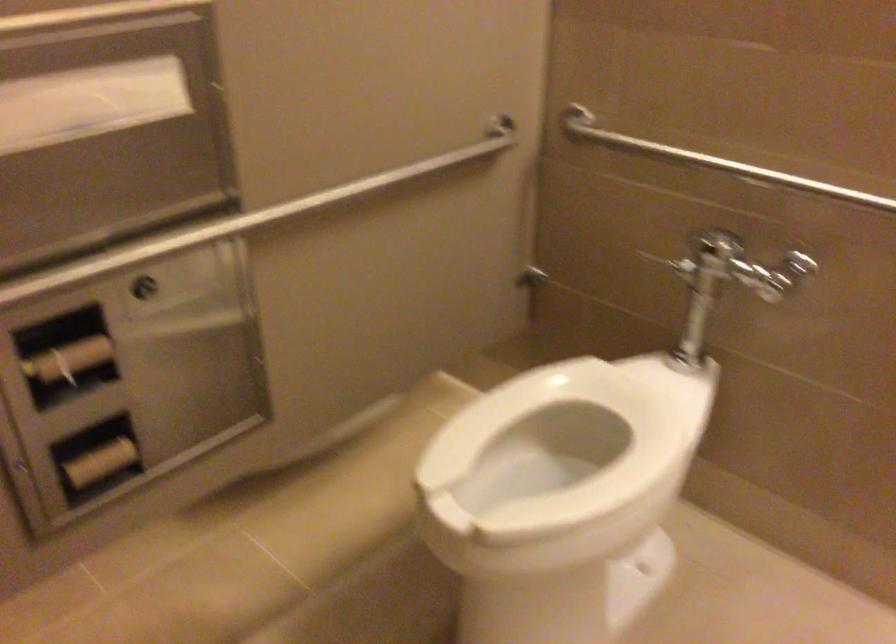
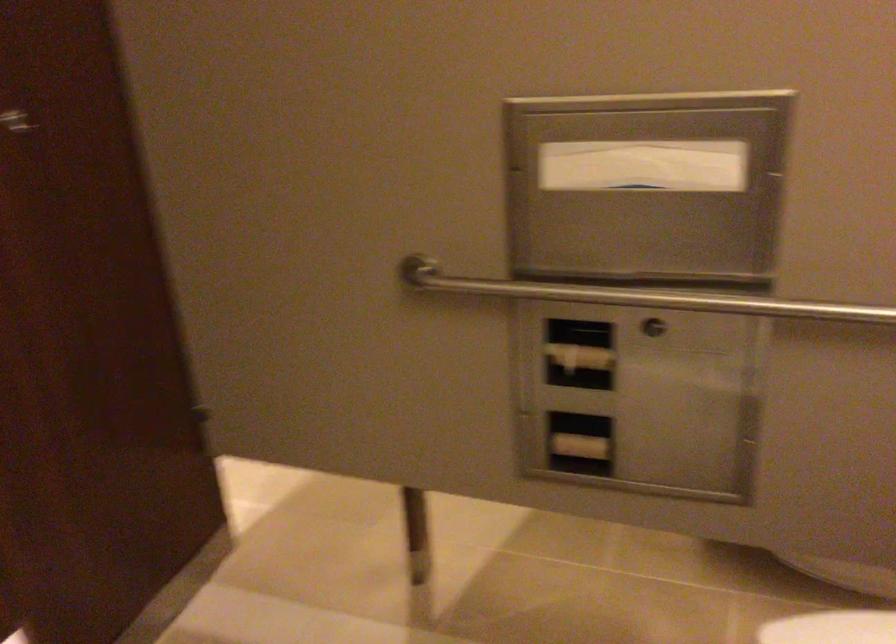
Question: Based on the continuous images, in which direction is the camera rotating? Reply with the corresponding letter.

Choices:
 (A) Left
 (B) Right
 (C) Up
 (D) Down

Answer: (A)